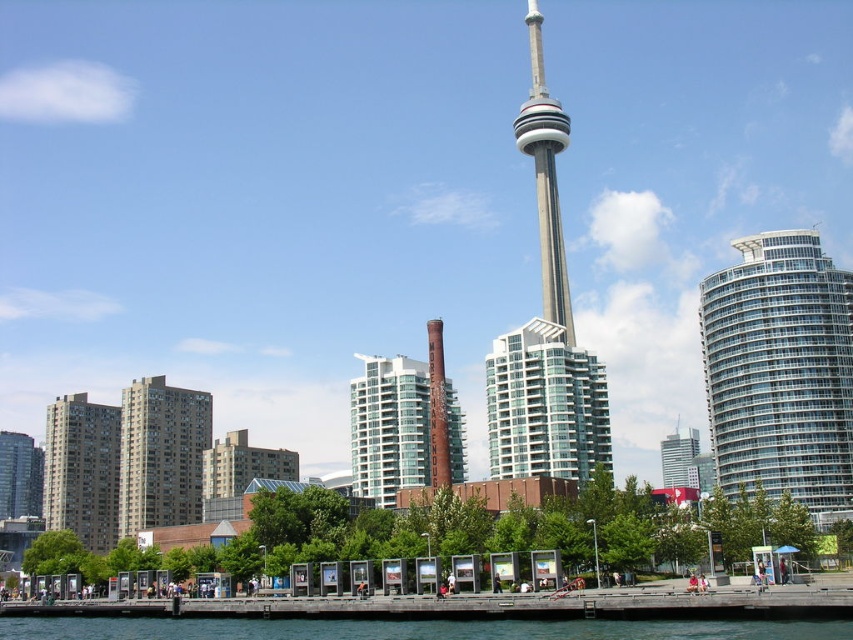
You are standing at the center of the waterfront promenade and want to take a photo of the CN Tower without the clear glass skyscraper at right blocking the view. Based on their positions, is it possible to frame the CN Tower without the skyscraper overlapping?

The clear glass skyscraper at right is positioned at point (780, 372). Since the CN Tower is the central structure in the image, its position is likely centered. If the skyscraper is at the right edge near coordinates (780, 372), there should be enough space to frame the CN Tower to the left of the skyscraper without overlap.

You are a tour guide leading a group of visitors. You want to show them both the glassy white building at center and the glassy concrete building at left. If your group can walk 5 meters per minute, how many minutes will it take to walk from one to the other?

The glassy white building at center and glassy concrete building at left are 64.09 meters apart from each other. At a walking speed of 5 meters per minute, it would take approximately 12.82 minutes to walk between them.